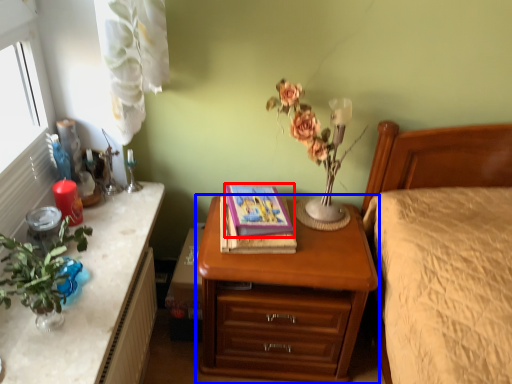
Question: Among these objects, which one is nearest to the camera, book (highlighted by a red box) or nightstand (highlighted by a blue box)?

Choices:
 (A) book
 (B) nightstand

Answer: (B)